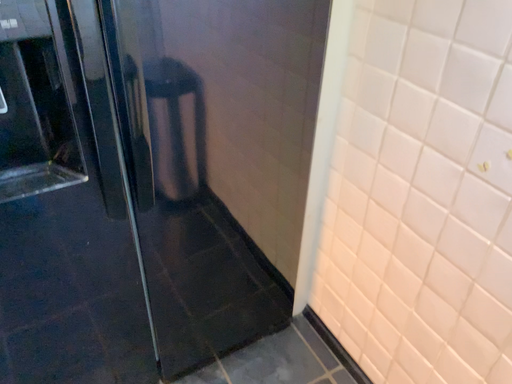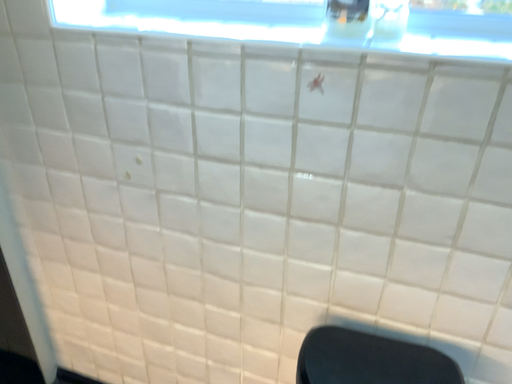
Question: How did the camera likely rotate when shooting the video?

Choices:
 (A) rotated left
 (B) rotated right

Answer: (B)